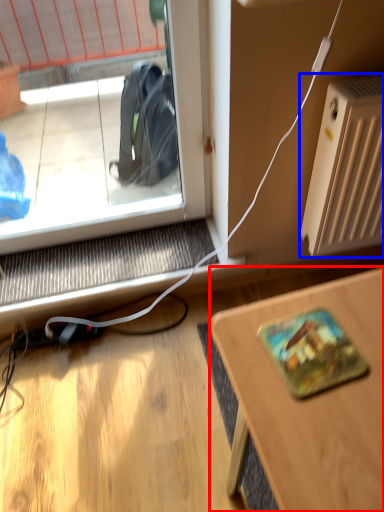
Question: Which object is closer to the camera taking this photo, desk (highlighted by a red box) or radiator (highlighted by a blue box)?

Choices:
 (A) desk
 (B) radiator

Answer: (A)